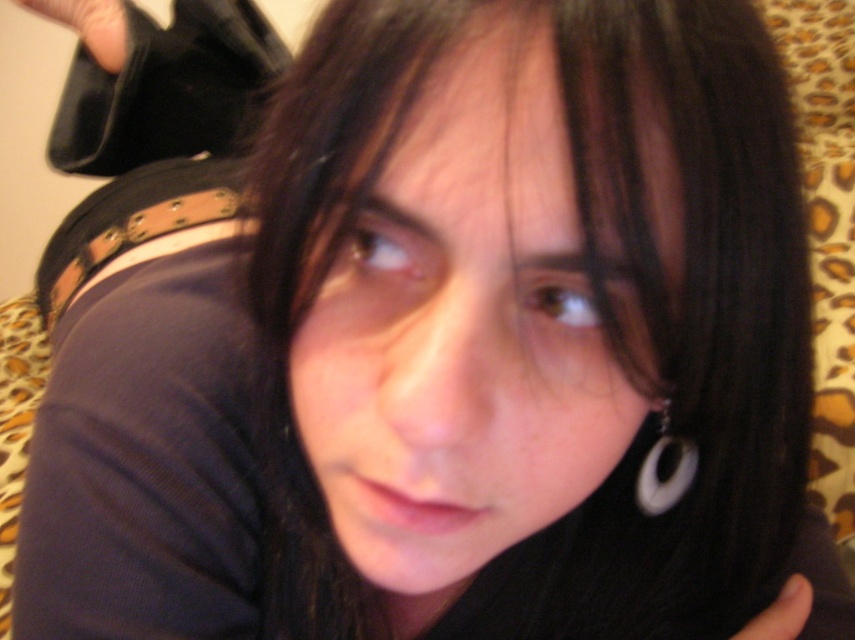
Question: Is smooth skin face at center bigger than black leather bag at upper left?

Choices:
 (A) yes
 (B) no

Answer: (B)

Question: Estimate the real-world distances between objects in this image. Which object is closer to the smooth skin face at center?

Choices:
 (A) black matte finger at lower right
 (B) black leather bag at upper left

Answer: (A)

Question: Is smooth skin face at center positioned before black leather bag at upper left?

Choices:
 (A) no
 (B) yes

Answer: (B)

Question: Which of the following is the farthest from the observer?

Choices:
 (A) (479, 68)
 (B) (99, 35)
 (C) (764, 620)

Answer: (B)

Question: Considering the relative positions of white plastic hoop at lower right and black matte finger at lower right in the image provided, where is white plastic hoop at lower right located with respect to black matte finger at lower right?

Choices:
 (A) below
 (B) above

Answer: (B)

Question: Which point is closer to the camera taking this photo?

Choices:
 (A) (464, 301)
 (B) (662, 452)
 (C) (111, 22)

Answer: (A)